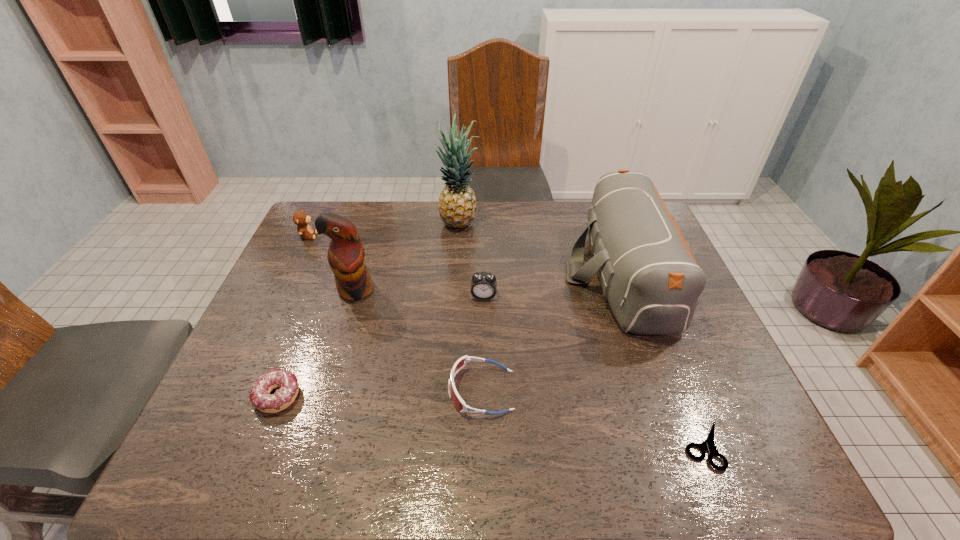
The width and height of the screenshot is (960, 540). Identify the location of vacant space at the far edge of the desktop. (372, 232).

In the image, there is a desktop. What are the coordinates of `vacant space at the near edge` in the screenshot? It's located at (340, 454).

This screenshot has height=540, width=960. In the image, there is a desktop. What are the coordinates of `free region at the left edge` in the screenshot? It's located at (211, 425).

This screenshot has height=540, width=960. In order to click on free space at the right edge of the desktop in this screenshot , I will do `click(720, 400)`.

Where is `empty location between the second shortest object and the alarm clock`? This screenshot has width=960, height=540. empty location between the second shortest object and the alarm clock is located at coordinates (381, 346).

Image resolution: width=960 pixels, height=540 pixels. I want to click on empty space between the sixth tallest object and the leftmost object, so click(395, 313).

This screenshot has height=540, width=960. Identify the location of free space between the alarm clock and the duffel bag. (552, 285).

Where is `vacant area that lies between the alarm clock and the second tallest object`? The height and width of the screenshot is (540, 960). vacant area that lies between the alarm clock and the second tallest object is located at coordinates (420, 293).

Locate an element on the screen. empty location between the shortest object and the second tallest object is located at coordinates pos(530,368).

Locate an element on the screen. Image resolution: width=960 pixels, height=540 pixels. free spot between the duffel bag and the pineapple is located at coordinates (540, 249).